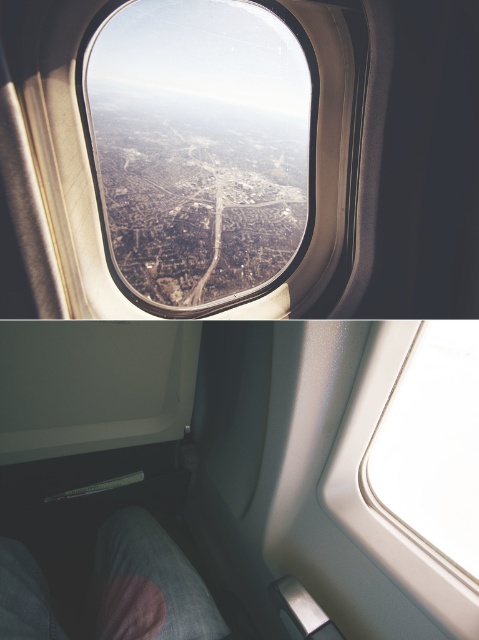
Which is in front, point (239, 202) or point (458, 333)?

Point (458, 333) is more forward.

Can you confirm if transparent glass airplane window at center is wider than white glossy window at upper center?

Yes.

Locate an element on the screen. The image size is (479, 640). transparent glass airplane window at center is located at coordinates (200, 147).